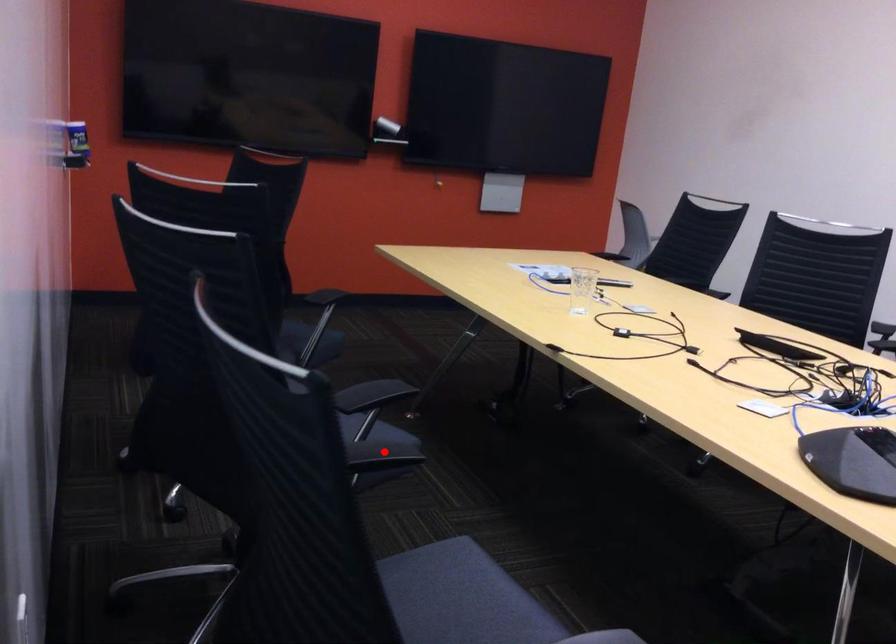
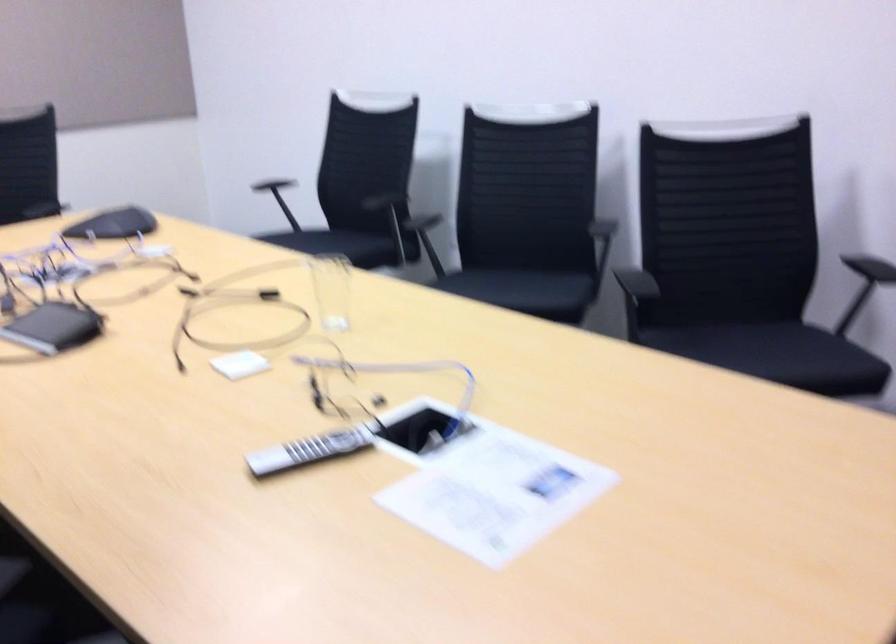
Question: I am providing you with two images of the same scene from different viewpoints. A red point is marked on the first image. Can you still see the location of the red point in image 2?

Choices:
 (A) Yes
 (B) No

Answer: (B)